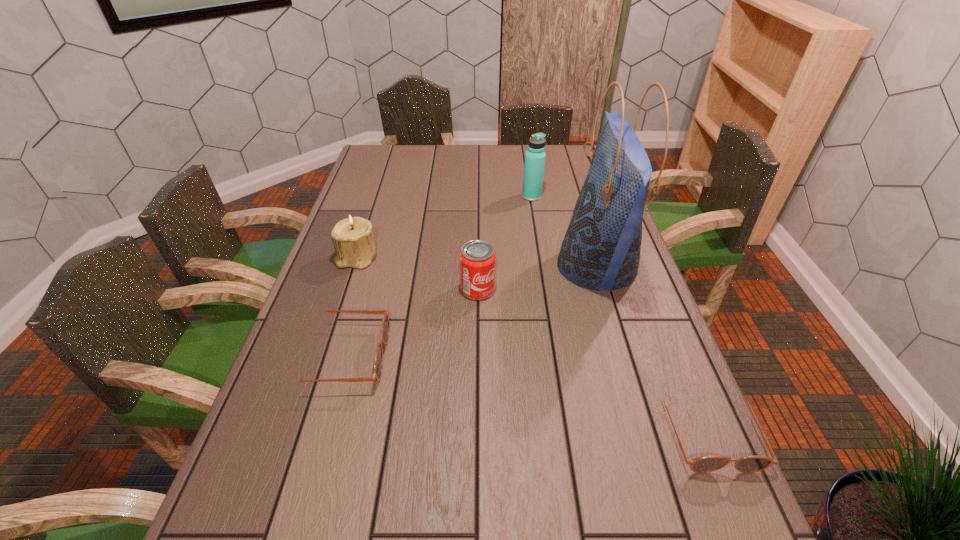
Where is `the taller sunglasses`? The height and width of the screenshot is (540, 960). the taller sunglasses is located at coordinates (377, 368).

The height and width of the screenshot is (540, 960). Identify the location of the left sunglasses. (377, 368).

The image size is (960, 540). Find the location of `the nearer sunglasses`. the nearer sunglasses is located at coordinates (750, 464).

This screenshot has height=540, width=960. I want to click on the shorter sunglasses, so click(750, 464).

The image size is (960, 540). Find the location of `the tallest object`. the tallest object is located at coordinates (x=601, y=249).

Where is `the fourth object from left to right`? This screenshot has width=960, height=540. the fourth object from left to right is located at coordinates (534, 163).

Identify the location of the fifth shortest object. (534, 163).

The height and width of the screenshot is (540, 960). I want to click on the third object from left to right, so click(477, 259).

In order to click on can in this screenshot , I will do `click(477, 259)`.

You are a GUI agent. You are given a task and a screenshot of the screen. Output one action in this format:
    pyautogui.click(x=<x>, y=<y>)
    Task: Click on the candle_holder
    The image size is (960, 540).
    Given the screenshot: What is the action you would take?
    pyautogui.click(x=352, y=237)